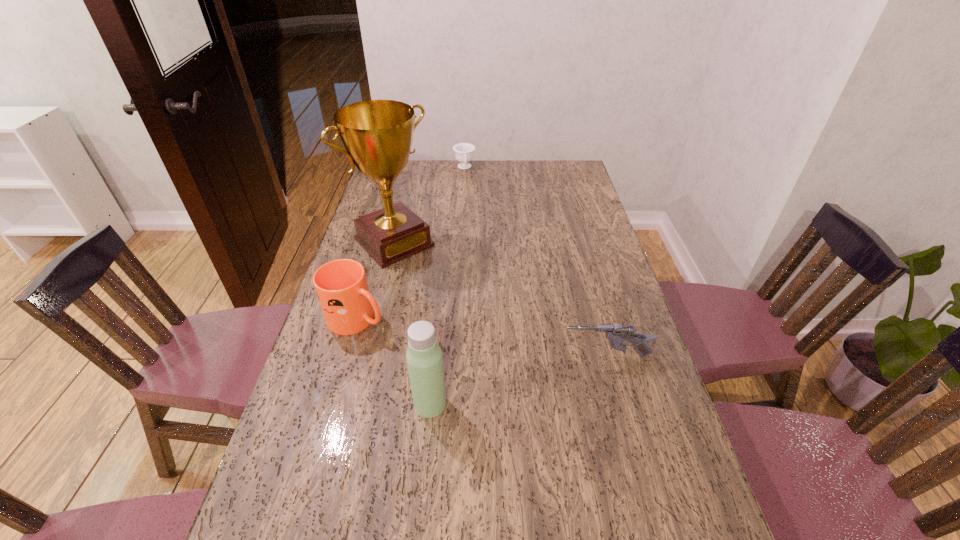
Find the location of `the second tallest object`. the second tallest object is located at coordinates (424, 358).

You are a GUI agent. You are given a task and a screenshot of the screen. Output one action in this format:
    pyautogui.click(x=<x>, y=<y>)
    Task: Click on the nearest object
    The width and height of the screenshot is (960, 540).
    Given the screenshot: What is the action you would take?
    pyautogui.click(x=424, y=358)

Image resolution: width=960 pixels, height=540 pixels. Find the location of `the fourth farthest object`. the fourth farthest object is located at coordinates (616, 333).

Find the location of a particular element. gun is located at coordinates (616, 333).

At what (x,y) coordinates should I click in order to perform the action: click on mug. Please return your answer as a coordinate pair (x, y). This screenshot has width=960, height=540. Looking at the image, I should click on (341, 286).

At what (x,y) coordinates should I click in order to perform the action: click on the third tallest object. Please return your answer as a coordinate pair (x, y). This screenshot has width=960, height=540. Looking at the image, I should click on (341, 286).

Locate an element on the screen. the second farthest object is located at coordinates (377, 134).

Locate an element on the screen. This screenshot has width=960, height=540. the tallest object is located at coordinates (377, 134).

Find the location of a particular element. The width and height of the screenshot is (960, 540). the shortest object is located at coordinates (464, 152).

You are a GUI agent. You are given a task and a screenshot of the screen. Output one action in this format:
    pyautogui.click(x=<x>, y=<y>)
    Task: Click on the teacup
    The width and height of the screenshot is (960, 540).
    Given the screenshot: What is the action you would take?
    pyautogui.click(x=464, y=152)